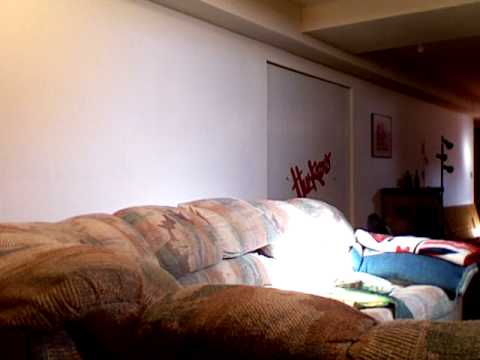
Find the location of a particular element. drop ceiling is located at coordinates (361, 32).